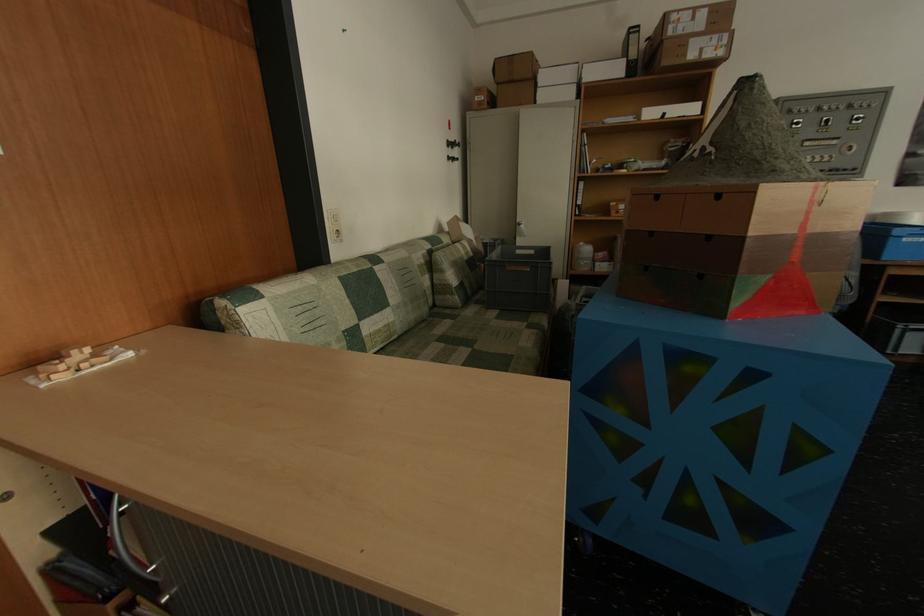
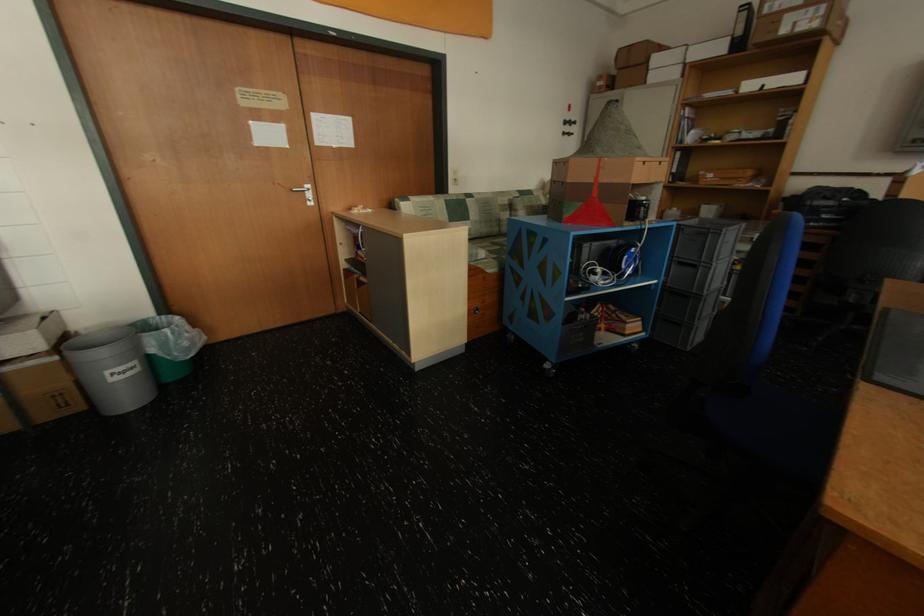
Where in the second image is the point corresponding to point 630,208 from the first image?

(719, 177)